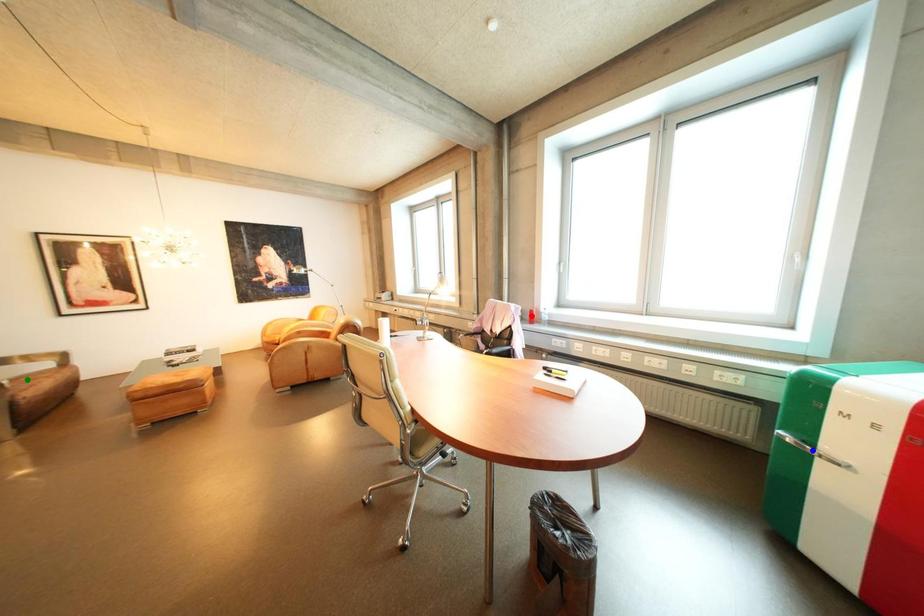
Order these from nearest to farthest:
- blue point
- green point
- red point

blue point < green point < red point